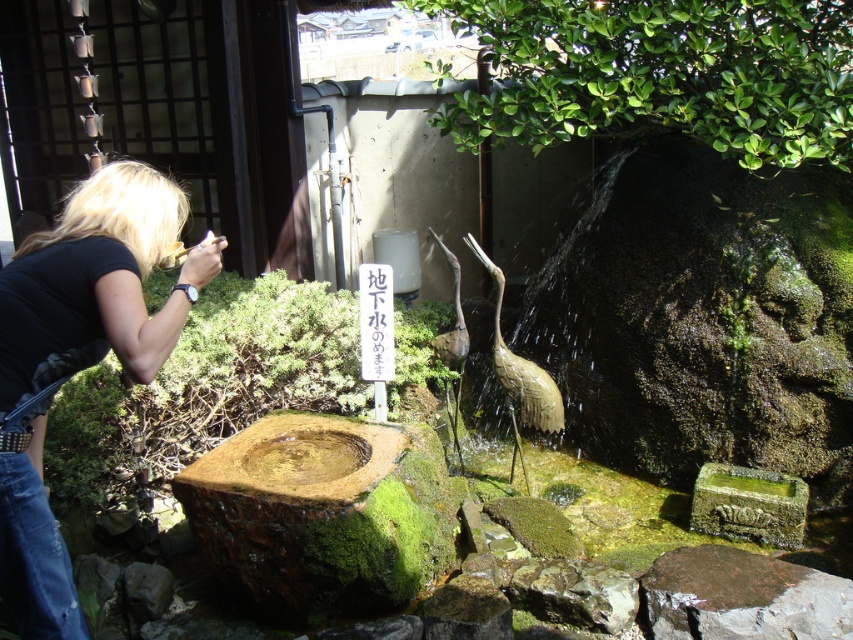
Question: Can you confirm if black fabric at left is thinner than green mossy rock at lower right?

Choices:
 (A) yes
 (B) no

Answer: (A)

Question: Which point is farther to the camera?

Choices:
 (A) green mossy rock at lower right
 (B) black fabric at left

Answer: (A)

Question: Which point is closer to the camera?

Choices:
 (A) green mossy rock at lower right
 (B) black fabric at left

Answer: (B)

Question: Is black fabric at left wider than green mossy rock at lower right?

Choices:
 (A) yes
 (B) no

Answer: (B)

Question: Can you confirm if black fabric at left is bigger than green mossy rock at lower right?

Choices:
 (A) yes
 (B) no

Answer: (A)